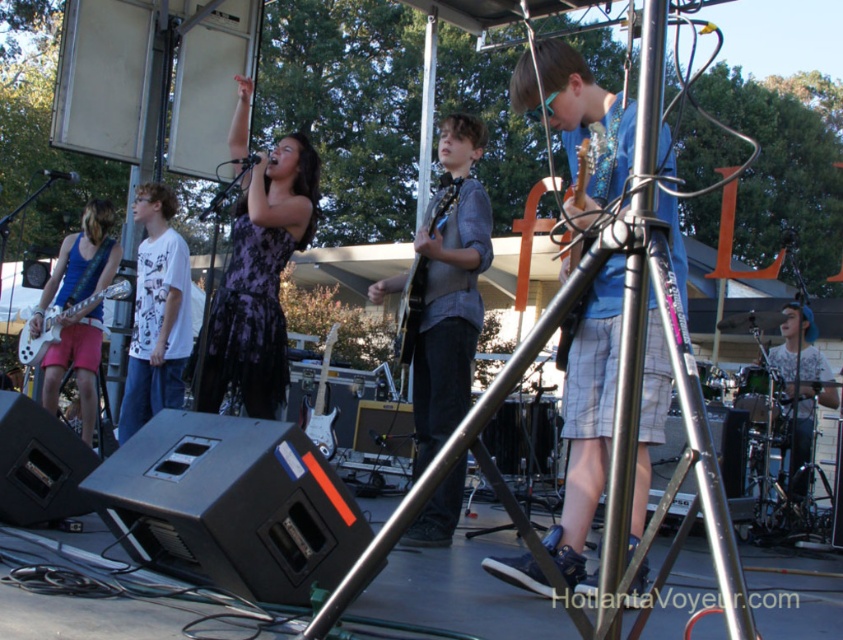
Which is in front, point (275, 182) or point (57, 349)?

Point (275, 182) is in front.

Which is behind, point (274, 218) or point (89, 218)?

The point (89, 218) is behind.

The height and width of the screenshot is (640, 843). Identify the location of purple floral dress at center. (259, 282).

Between point (412, 344) and point (90, 307), which one is positioned behind?

The point (90, 307) is behind.

Is glossy electric guitar at center positioned behind white glossy electric guitar at left?

No, glossy electric guitar at center is closer to the viewer.

Where is `glossy electric guitar at center`? The height and width of the screenshot is (640, 843). glossy electric guitar at center is located at coordinates (411, 308).

Identify the location of glossy electric guitar at center. (411, 308).

Does purple floral dress at center appear over white glossy electric guitar at left?

Yes, purple floral dress at center is above white glossy electric guitar at left.

Where is `purple floral dress at center`? purple floral dress at center is located at coordinates (259, 282).